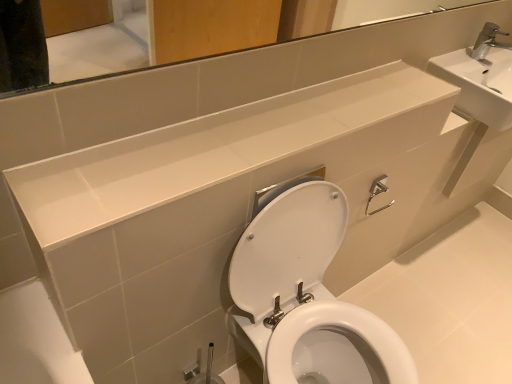
Question: Is white glossy mirror at upper center surrounding white glossy counter top at upper center?

Choices:
 (A) no
 (B) yes

Answer: (A)

Question: Could you tell me if white glossy mirror at upper center is turned towards white glossy counter top at upper center?

Choices:
 (A) no
 (B) yes

Answer: (A)

Question: From the image's perspective, is white glossy mirror at upper center located beneath white glossy counter top at upper center?

Choices:
 (A) no
 (B) yes

Answer: (A)

Question: Does white glossy mirror at upper center have a smaller size compared to white glossy counter top at upper center?

Choices:
 (A) yes
 (B) no

Answer: (B)

Question: Is white glossy mirror at upper center bigger than white glossy counter top at upper center?

Choices:
 (A) no
 (B) yes

Answer: (B)

Question: From a real-world perspective, is white glossy counter top at upper center physically located above or below white glossy mirror at upper center?

Choices:
 (A) above
 (B) below

Answer: (B)

Question: Is white glossy counter top at upper center wider or thinner than white glossy mirror at upper center?

Choices:
 (A) thin
 (B) wide

Answer: (B)

Question: Considering the relative positions of white glossy counter top at upper center and white glossy mirror at upper center in the image provided, is white glossy counter top at upper center to the left or to the right of white glossy mirror at upper center?

Choices:
 (A) right
 (B) left

Answer: (B)

Question: Is white glossy counter top at upper center inside the boundaries of white glossy mirror at upper center, or outside?

Choices:
 (A) outside
 (B) inside

Answer: (A)

Question: Is white glossy mirror at upper center in front of or behind white ceramic sink at upper right in the image?

Choices:
 (A) behind
 (B) front

Answer: (B)

Question: From a real-world perspective, is white glossy mirror at upper center physically located above or below white ceramic sink at upper right?

Choices:
 (A) below
 (B) above

Answer: (B)

Question: From the image's perspective, is white glossy mirror at upper center positioned above or below white ceramic sink at upper right?

Choices:
 (A) above
 (B) below

Answer: (A)

Question: From their relative heights in the image, would you say white glossy mirror at upper center is taller or shorter than white ceramic sink at upper right?

Choices:
 (A) short
 (B) tall

Answer: (A)

Question: In terms of width, does white glossy mirror at upper center look wider or thinner when compared to white glossy toilet at center?

Choices:
 (A) wide
 (B) thin

Answer: (B)

Question: In the image, is white glossy mirror at upper center on the left side or the right side of white glossy toilet at center?

Choices:
 (A) right
 (B) left

Answer: (B)